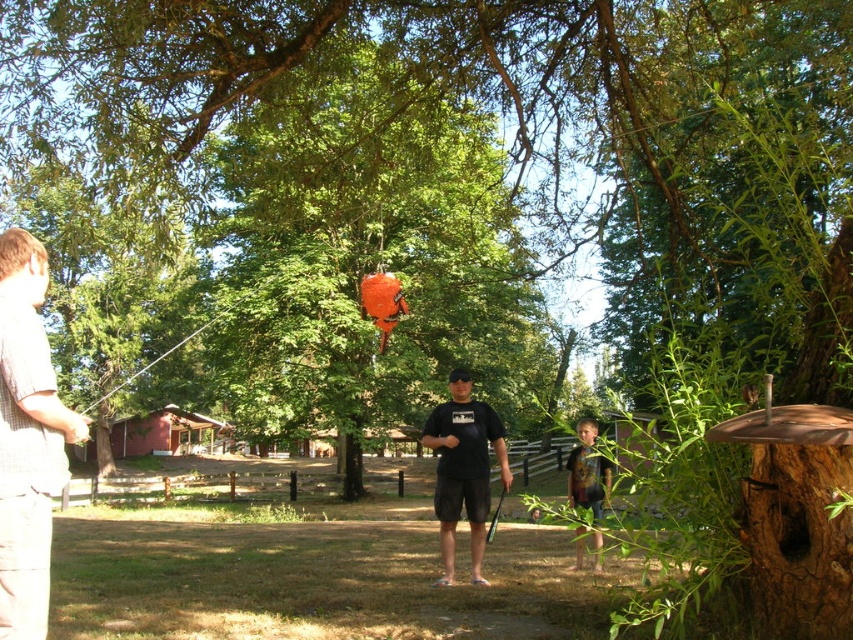
Question: Does black matte t-shirt at center appear over multicolored fabric shirt at lower right?

Choices:
 (A) no
 (B) yes

Answer: (B)

Question: Does plaid shirt at left appear under black matte t-shirt at center?

Choices:
 (A) yes
 (B) no

Answer: (B)

Question: Is plaid shirt at left positioned before multicolored fabric shirt at lower right?

Choices:
 (A) no
 (B) yes

Answer: (B)

Question: Considering the real-world distances, which object is farthest from the black matte t-shirt at center?

Choices:
 (A) plaid shirt at left
 (B) multicolored fabric shirt at lower right

Answer: (A)

Question: Which point is farther to the camera?

Choices:
 (A) plaid shirt at left
 (B) black matte t-shirt at center

Answer: (B)

Question: Which point is farther to the camera?

Choices:
 (A) (596, 561)
 (B) (451, 394)
 (C) (22, 321)

Answer: (A)